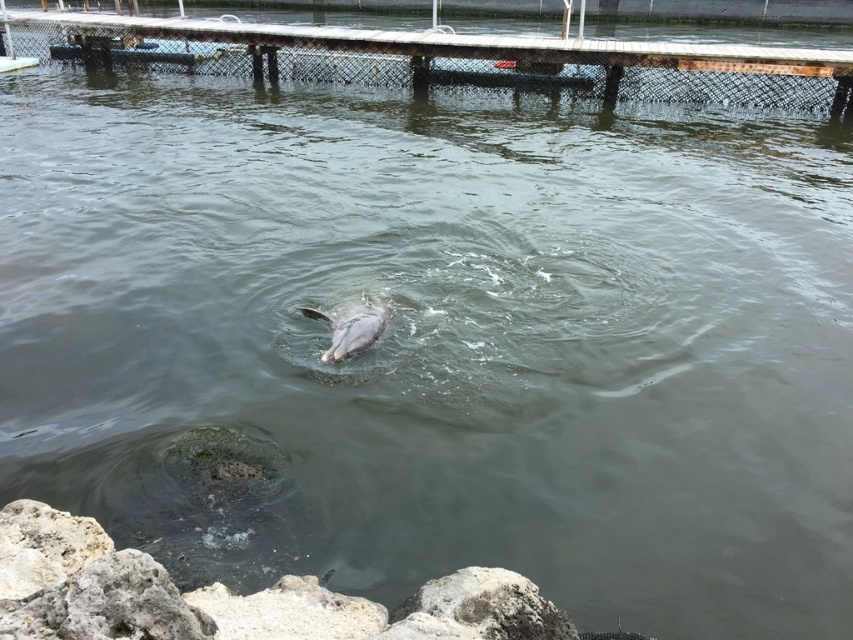
Can you confirm if gray rough rock at lower center is wider than gray matte dolphin at center?

Yes.

Does gray rough rock at lower center appear on the right side of gray matte dolphin at center?

Indeed, gray rough rock at lower center is positioned on the right side of gray matte dolphin at center.

Who is more forward, (x=445, y=579) or (x=346, y=326)?

Point (x=445, y=579)

The image size is (853, 640). What are the coordinates of `gray rough rock at lower center` in the screenshot? It's located at (479, 609).

Between wooden dock at upper center and gray rough rock at lower center, which one appears on the left side from the viewer's perspective?

Positioned to the left is wooden dock at upper center.

Can you confirm if wooden dock at upper center is smaller than gray rough rock at lower center?

No.

Find the location of `wooden dock at upper center`. wooden dock at upper center is located at coordinates tap(450, 60).

This screenshot has height=640, width=853. Describe the element at coordinates (450, 60) in the screenshot. I see `wooden dock at upper center` at that location.

Is wooden dock at upper center taller than gray matte dolphin at center?

Yes, wooden dock at upper center is taller than gray matte dolphin at center.

Where is `wooden dock at upper center`? Image resolution: width=853 pixels, height=640 pixels. wooden dock at upper center is located at coordinates (450, 60).

Locate an element on the screen. wooden dock at upper center is located at coordinates (450, 60).